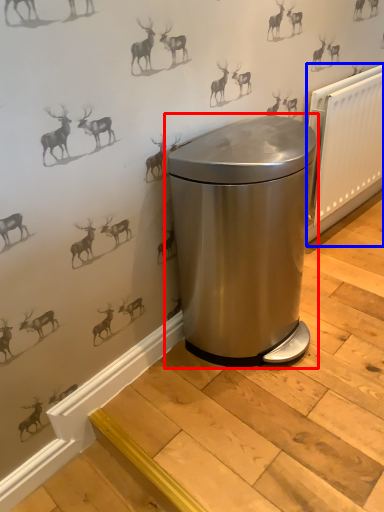
Question: Among these objects, which one is farthest to the camera, waste container (highlighted by a red box) or radiator (highlighted by a blue box)?

Choices:
 (A) waste container
 (B) radiator

Answer: (B)